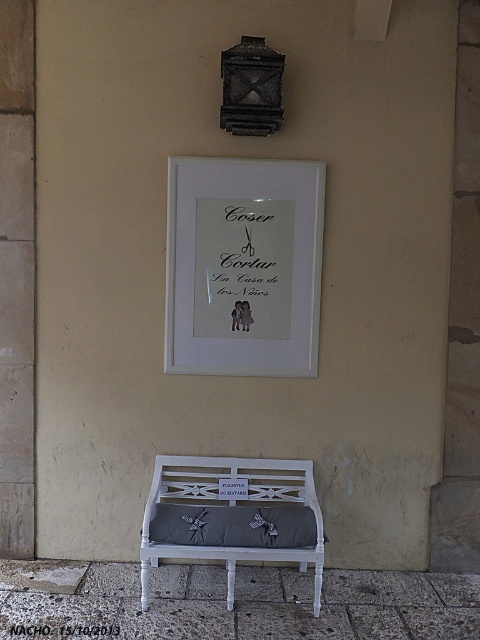
Question: Which object appears closest to the camera in this image?

Choices:
 (A) gray fabric pillow at center
 (B) white matte picture frame at upper center

Answer: (A)

Question: Can you confirm if white matte picture frame at upper center is thinner than black paper at center?

Choices:
 (A) yes
 (B) no

Answer: (B)

Question: Which point is farther to the camera?

Choices:
 (A) white matte picture frame at upper center
 (B) black paper at center

Answer: (A)

Question: Is white matte picture frame at upper center behind gray fabric pillow at center?

Choices:
 (A) yes
 (B) no

Answer: (A)

Question: Which of the following is the farthest from the observer?

Choices:
 (A) (235, 484)
 (B) (279, 538)

Answer: (A)

Question: Does white painted wood park bench at lower center appear under gray fabric pillow at center?

Choices:
 (A) no
 (B) yes

Answer: (B)